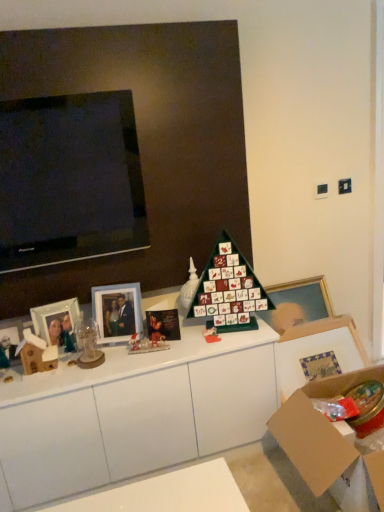
Question: Is matte glass photo frame at left, the third picture frame when ordered from right to left, positioned behind glossy paper christmas card at center?

Choices:
 (A) yes
 (B) no

Answer: (B)

Question: Considering the relative sizes of matte glass photo frame at left, the third picture frame when ordered from right to left, and glossy paper christmas card at center in the image provided, is matte glass photo frame at left, the third picture frame when ordered from right to left, thinner than glossy paper christmas card at center?

Choices:
 (A) yes
 (B) no

Answer: (A)

Question: Is glossy paper christmas card at center at the back of matte glass photo frame at left, marked as the 2th picture frame in a left-to-right arrangement?

Choices:
 (A) no
 (B) yes

Answer: (A)

Question: Is matte glass photo frame at left, the third picture frame when ordered from right to left, with glossy paper christmas card at center?

Choices:
 (A) no
 (B) yes

Answer: (A)

Question: Is matte glass photo frame at left, marked as the 2th picture frame in a left-to-right arrangement, outside of glossy paper christmas card at center?

Choices:
 (A) yes
 (B) no

Answer: (A)

Question: Considering their positions, is wooden picture frame at left, the 4th picture frame viewed from the right, located in front of or behind green matte advent calendar at center?

Choices:
 (A) front
 (B) behind

Answer: (A)

Question: Looking at their shapes, would you say wooden picture frame at left, the 4th picture frame viewed from the right, is wider or thinner than green matte advent calendar at center?

Choices:
 (A) thin
 (B) wide

Answer: (A)

Question: Is wooden picture frame at left, the 1th picture frame viewed from the left, situated inside green matte advent calendar at center or outside?

Choices:
 (A) outside
 (B) inside

Answer: (A)

Question: In terms of height, does wooden picture frame at left, the 1th picture frame viewed from the left, look taller or shorter compared to green matte advent calendar at center?

Choices:
 (A) short
 (B) tall

Answer: (A)

Question: From a real-world perspective, is wooden picture frame at left, the 4th picture frame viewed from the right, physically located above or below glossy paper christmas card at center?

Choices:
 (A) above
 (B) below

Answer: (A)

Question: Considering the positions of point (3, 352) and point (178, 326), is point (3, 352) closer or farther from the camera than point (178, 326)?

Choices:
 (A) closer
 (B) farther

Answer: (A)

Question: From their relative heights in the image, would you say wooden picture frame at left, the 1th picture frame viewed from the left, is taller or shorter than glossy paper christmas card at center?

Choices:
 (A) tall
 (B) short

Answer: (A)

Question: Visually, is wooden picture frame at left, the 1th picture frame viewed from the left, positioned to the left or to the right of glossy paper christmas card at center?

Choices:
 (A) right
 (B) left

Answer: (B)

Question: In terms of width, does green matte advent calendar at center look wider or thinner when compared to matte glass picture frame at center left, positioned as the 2th picture frame in right-to-left order?

Choices:
 (A) wide
 (B) thin

Answer: (A)

Question: Would you say green matte advent calendar at center is inside or outside matte glass picture frame at center left, positioned as the 2th picture frame in right-to-left order?

Choices:
 (A) outside
 (B) inside

Answer: (A)